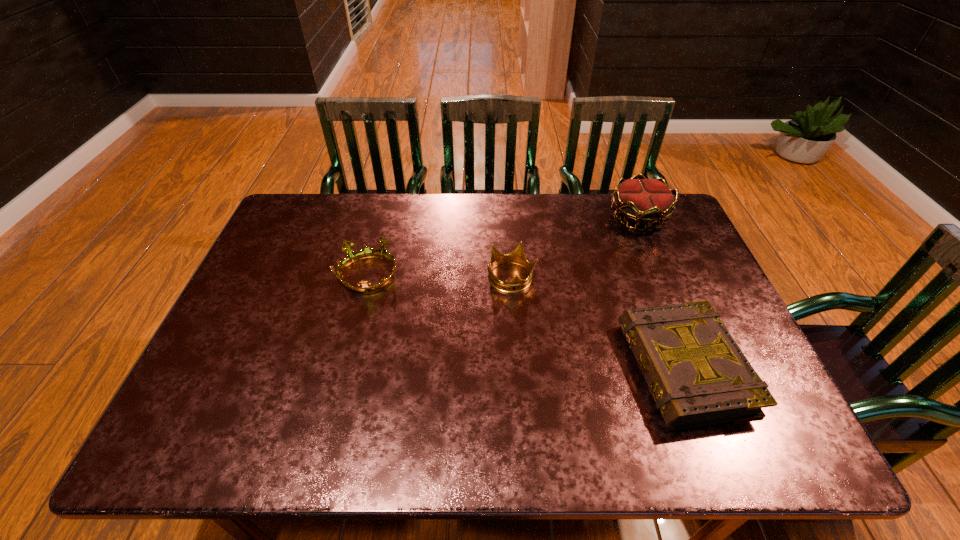
Identify which object is located as the second nearest to the farthest object. Please provide its 2D coordinates. Your answer should be formatted as a tuple, i.e. [(x, y)], where the tuple contains the x and y coordinates of a point satisfying the conditions above.

[(697, 374)]

Locate an element on the screen. The image size is (960, 540). crown object that ranks as the closest to the leftmost object is located at coordinates (516, 284).

Select which crown is the second closest to the tallest crown. Please provide its 2D coordinates. Your answer should be formatted as a tuple, i.e. [(x, y)], where the tuple contains the x and y coordinates of a point satisfying the conditions above.

[(352, 256)]

The height and width of the screenshot is (540, 960). I want to click on free spot that satisfies the following two spatial constraints: 1. on the front side of the second crown from right to left; 2. on the left side of the nearest object, so click(x=517, y=368).

The height and width of the screenshot is (540, 960). Find the location of `vacant region that satisfies the following two spatial constraints: 1. on the back side of the farthest crown; 2. on the left side of the third object from right to left`. vacant region that satisfies the following two spatial constraints: 1. on the back side of the farthest crown; 2. on the left side of the third object from right to left is located at coordinates (507, 217).